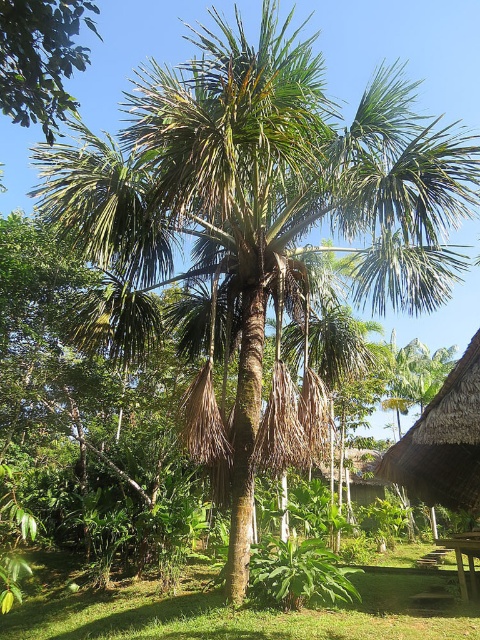
You are standing in a tropical garden and want to walk from your current position to the point marked as point (463, 541). However, there is a point marked as point (410, 600) blocking your path. Can you walk around it to reach your destination?

Point (410, 600) is in front of point (463, 541), so you cannot directly reach point (463, 541) without moving around point (410, 600) first.